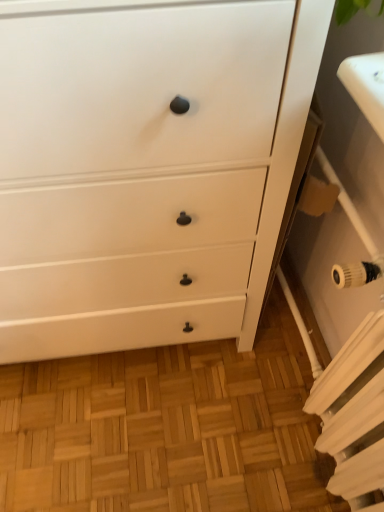
The height and width of the screenshot is (512, 384). Describe the element at coordinates (354, 414) in the screenshot. I see `white metallic radiator at lower right` at that location.

Where is `white metallic radiator at lower right`? This screenshot has height=512, width=384. white metallic radiator at lower right is located at coordinates (354, 414).

Measure the distance between white metallic radiator at lower right and camera.

white metallic radiator at lower right and camera are 29.57 inches apart.

The image size is (384, 512). In order to click on white matte chest of drawers at center in this screenshot , I will do `click(145, 167)`.

This screenshot has height=512, width=384. Describe the element at coordinates (145, 167) in the screenshot. I see `white matte chest of drawers at center` at that location.

The image size is (384, 512). In order to click on white metallic radiator at lower right in this screenshot , I will do `click(354, 414)`.

Which is more to the left, white matte chest of drawers at center or white metallic radiator at lower right?

From the viewer's perspective, white matte chest of drawers at center appears more on the left side.

Is white matte chest of drawers at center further to the viewer compared to white metallic radiator at lower right?

No, white matte chest of drawers at center is closer to the camera.

Considering the positions of points (233, 186) and (359, 500), is point (233, 186) farther from camera compared to point (359, 500)?

No, it is in front of (359, 500).

From the image's perspective, does white matte chest of drawers at center appear higher than white metallic radiator at lower right?

Yes, from the image's perspective, white matte chest of drawers at center is over white metallic radiator at lower right.

From a real-world perspective, between white matte chest of drawers at center and white metallic radiator at lower right, who is vertically lower?

white matte chest of drawers at center is physically lower.

Is white matte chest of drawers at center wider than white metallic radiator at lower right?

Correct, the width of white matte chest of drawers at center exceeds that of white metallic radiator at lower right.

Does white matte chest of drawers at center have a lesser height compared to white metallic radiator at lower right?

In fact, white matte chest of drawers at center may be taller than white metallic radiator at lower right.

Who is bigger, white matte chest of drawers at center or white metallic radiator at lower right?

With larger size is white matte chest of drawers at center.

Is white matte chest of drawers at center surrounding white metallic radiator at lower right?

No, white metallic radiator at lower right is not a part of white matte chest of drawers at center.

Is white matte chest of drawers at center touching white metallic radiator at lower right?

white matte chest of drawers at center is not next to white metallic radiator at lower right, and they're not touching.

Consider the image. Is white matte chest of drawers at center looking in the opposite direction of white metallic radiator at lower right?

white matte chest of drawers at center does not have its back to white metallic radiator at lower right.

What's the angular difference between white matte chest of drawers at center and white metallic radiator at lower right's facing directions?

There is a 88.1-degree angle between the facing directions of white matte chest of drawers at center and white metallic radiator at lower right.

How much distance is there between white matte chest of drawers at center and white metallic radiator at lower right?

white matte chest of drawers at center is 18.38 inches from white metallic radiator at lower right.

Find the location of a particular element. This screenshot has width=384, height=512. chest of drawers in front of the white metallic radiator at lower right is located at coordinates (145, 167).

Is white metallic radiator at lower right to the right of white matte chest of drawers at center from the viewer's perspective?

Yes.

Relative to white matte chest of drawers at center, is white metallic radiator at lower right in front or behind?

Visually, white metallic radiator at lower right is located behind white matte chest of drawers at center.

Does point (354, 485) lie in front of point (172, 10)?

No.

From the image's perspective, relative to white matte chest of drawers at center, is white metallic radiator at lower right above or below?

white metallic radiator at lower right is situated lower than white matte chest of drawers at center in the image.

From a real-world perspective, does white metallic radiator at lower right sit lower than white matte chest of drawers at center?

No, from a real-world perspective, white metallic radiator at lower right is not beneath white matte chest of drawers at center.

Is white metallic radiator at lower right wider or thinner than white matte chest of drawers at center?

Clearly, white metallic radiator at lower right has less width compared to white matte chest of drawers at center.

From the picture: Is white metallic radiator at lower right shorter than white matte chest of drawers at center?

Yes.

Considering the relative sizes of white metallic radiator at lower right and white matte chest of drawers at center in the image provided, is white metallic radiator at lower right bigger than white matte chest of drawers at center?

Actually, white metallic radiator at lower right might be smaller than white matte chest of drawers at center.

Can we say white metallic radiator at lower right lies outside white matte chest of drawers at center?

Indeed, white metallic radiator at lower right is completely outside white matte chest of drawers at center.

Are white metallic radiator at lower right and white matte chest of drawers at center making contact?

white metallic radiator at lower right is not next to white matte chest of drawers at center, and they're not touching.

Is white metallic radiator at lower right positioned with its back to white matte chest of drawers at center?

No, white metallic radiator at lower right's orientation is not away from white matte chest of drawers at center.

Measure the distance between white metallic radiator at lower right and white matte chest of drawers at center.

18.38 inches.

Locate an element on the screen. The height and width of the screenshot is (512, 384). the chest of drawers located underneath the white metallic radiator at lower right (from a real-world perspective) is located at coordinates (145, 167).

Where is `radiator above the white matte chest of drawers at center (from a real-world perspective)`? The height and width of the screenshot is (512, 384). radiator above the white matte chest of drawers at center (from a real-world perspective) is located at coordinates (354, 414).

This screenshot has height=512, width=384. Identify the location of radiator on the right of white matte chest of drawers at center. (354, 414).